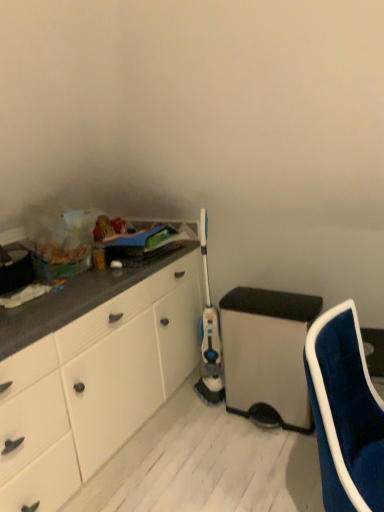
Where is `vacant point above matte plastic trash can at lower right (from a real-world perspective)`? The width and height of the screenshot is (384, 512). vacant point above matte plastic trash can at lower right (from a real-world perspective) is located at coordinates (250, 294).